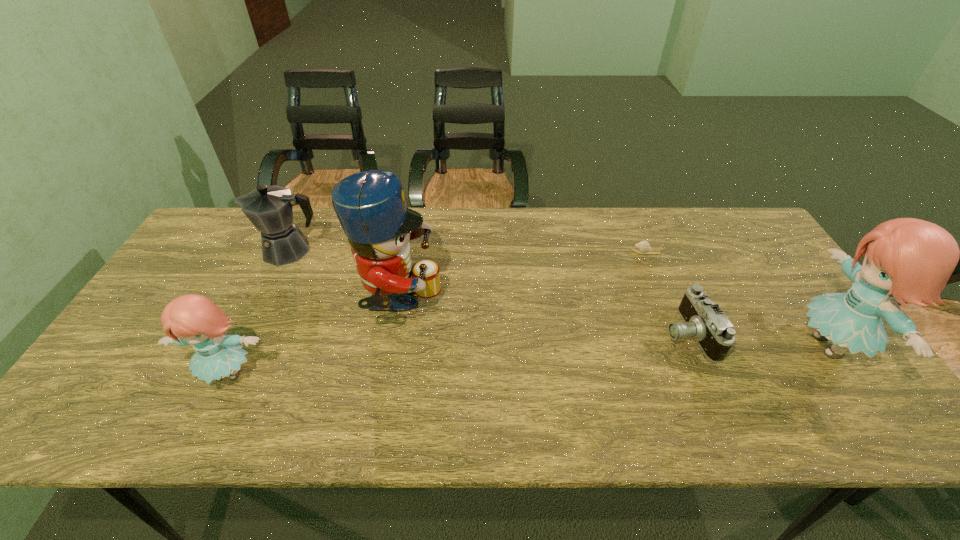
Where is `the left doll`? the left doll is located at coordinates (194, 320).

This screenshot has width=960, height=540. In order to click on the taller doll in this screenshot , I will do `click(913, 259)`.

Locate an element on the screen. The height and width of the screenshot is (540, 960). the rightmost object is located at coordinates (913, 259).

You are a GUI agent. You are given a task and a screenshot of the screen. Output one action in this format:
    pyautogui.click(x=<x>, y=<y>)
    Task: Click on the shortest object
    The width and height of the screenshot is (960, 540).
    Given the screenshot: What is the action you would take?
    pyautogui.click(x=643, y=247)

Locate an element on the screen. coffeepot is located at coordinates (269, 209).

Identify the location of nutcracker. (370, 205).

Locate an element on the screen. camera is located at coordinates point(703,320).

Locate an element on the screen. free location located on the front-facing side of the right doll is located at coordinates pyautogui.click(x=725, y=346).

At what (x,y) coordinates should I click in order to perform the action: click on free location located 0.400m on the front-facing side of the right doll. Please return your answer as a coordinate pair (x, y). Looking at the image, I should click on (633, 346).

Locate an element on the screen. blank space located on the front-facing side of the right doll is located at coordinates (729, 346).